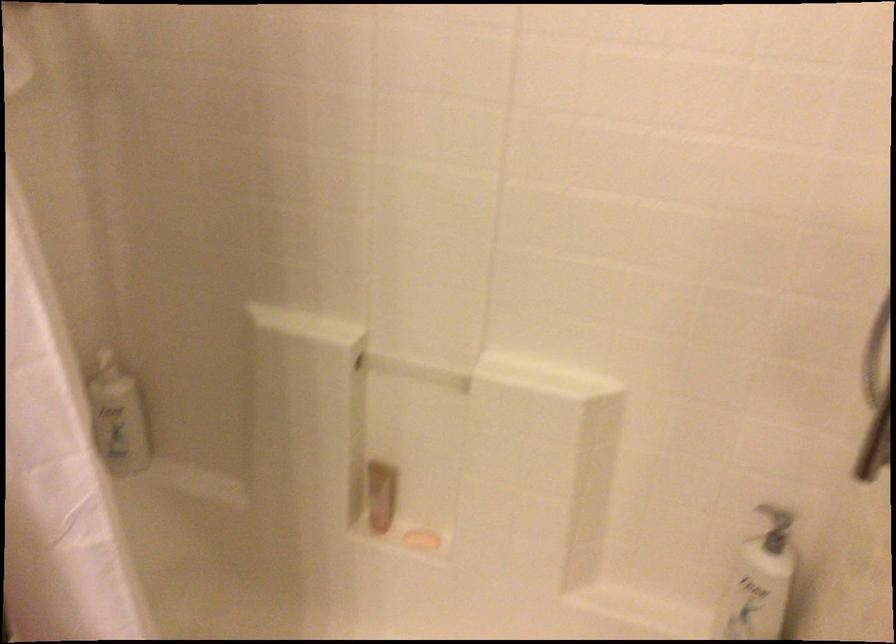
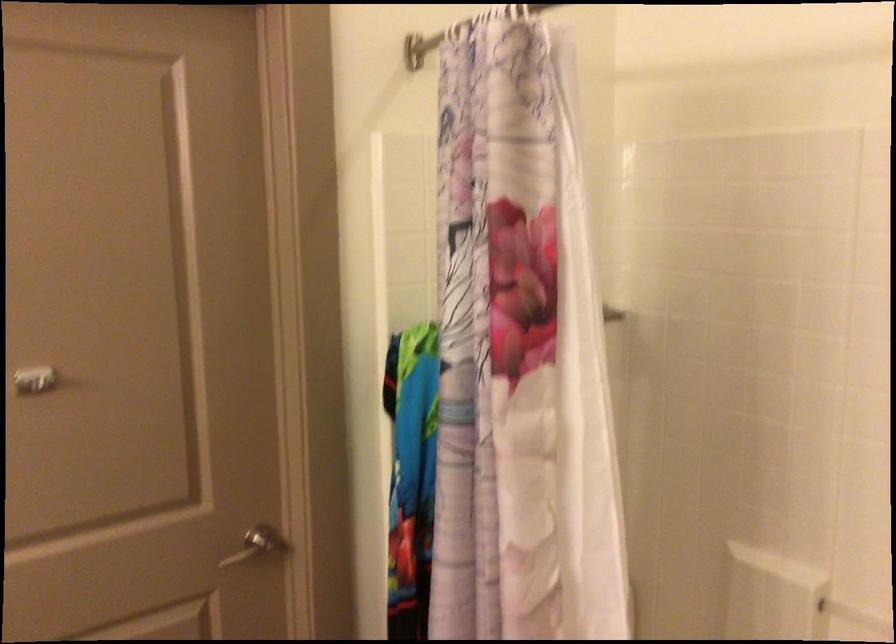
Question: I am providing you with two images of the same scene from different viewpoints. Please identify which objects are invisible in image2.

Choices:
 (A) patterned shower curtain
 (B) gray and black backpack
 (C) silver door handle
 (D) white pump bottle top

Answer: (D)